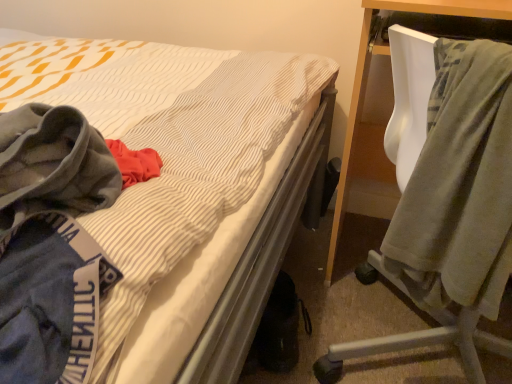
Question: From a real-world perspective, is gray fleece hoodie at left physically below velvet green blanket at right?

Choices:
 (A) no
 (B) yes

Answer: (A)

Question: Would you say velvet green blanket at right is part of gray fleece hoodie at left's contents?

Choices:
 (A) no
 (B) yes

Answer: (A)

Question: Is gray fleece hoodie at left to the right of velvet green blanket at right from the viewer's perspective?

Choices:
 (A) yes
 (B) no

Answer: (B)

Question: Is gray fleece hoodie at left closer to camera compared to velvet green blanket at right?

Choices:
 (A) yes
 (B) no

Answer: (A)

Question: From a real-world perspective, is gray fleece hoodie at left located higher than velvet green blanket at right?

Choices:
 (A) yes
 (B) no

Answer: (A)

Question: Is gray fleece hoodie at left not close to velvet green blanket at right?

Choices:
 (A) yes
 (B) no

Answer: (B)

Question: From a real-world perspective, does velvet green blanket at right stand above gray fleece hoodie at left?

Choices:
 (A) no
 (B) yes

Answer: (A)

Question: Considering the relative sizes of velvet green blanket at right and gray fleece hoodie at left in the image provided, is velvet green blanket at right shorter than gray fleece hoodie at left?

Choices:
 (A) yes
 (B) no

Answer: (B)

Question: Is velvet green blanket at right facing away from gray fleece hoodie at left?

Choices:
 (A) no
 (B) yes

Answer: (A)

Question: Does velvet green blanket at right have a larger size compared to gray fleece hoodie at left?

Choices:
 (A) no
 (B) yes

Answer: (B)

Question: Considering the relative sizes of velvet green blanket at right and gray fleece hoodie at left in the image provided, is velvet green blanket at right taller than gray fleece hoodie at left?

Choices:
 (A) no
 (B) yes

Answer: (B)

Question: Is velvet green blanket at right at the right side of gray fleece hoodie at left?

Choices:
 (A) no
 (B) yes

Answer: (B)

Question: Considering the positions of velvet green blanket at right and gray fleece hoodie at left in the image, is velvet green blanket at right wider or thinner than gray fleece hoodie at left?

Choices:
 (A) thin
 (B) wide

Answer: (B)